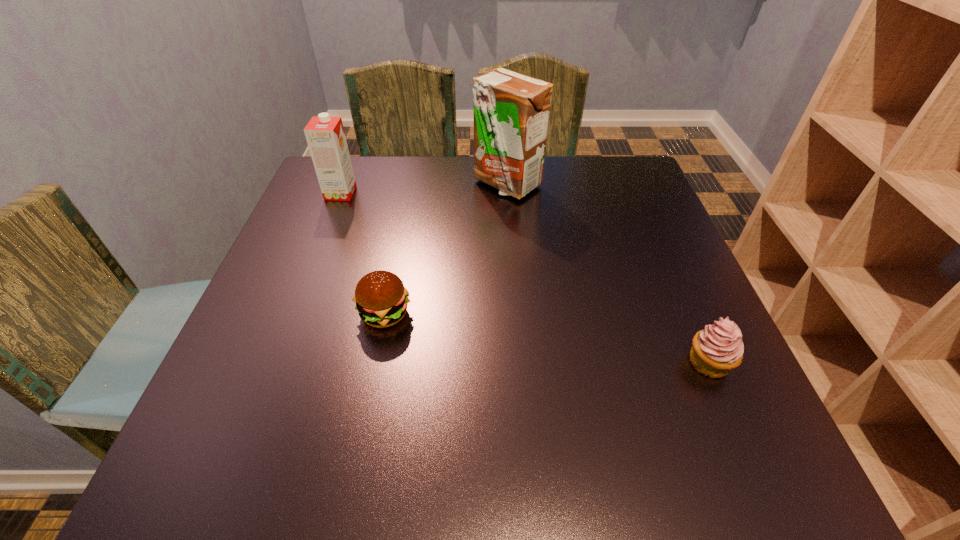
Find the location of a particular element. The height and width of the screenshot is (540, 960). vacant space at the near left corner is located at coordinates (258, 431).

What are the coordinates of `vacant space at the far right corner of the desktop` in the screenshot? It's located at (607, 180).

Locate an element on the screen. This screenshot has height=540, width=960. vacant region between the left carton and the third farthest object is located at coordinates (363, 253).

Where is `blank region between the cupcake and the second object from right to left`? The image size is (960, 540). blank region between the cupcake and the second object from right to left is located at coordinates [608, 273].

I want to click on unoccupied position between the leftmost object and the second nearest object, so click(x=363, y=253).

You are a GUI agent. You are given a task and a screenshot of the screen. Output one action in this format:
    pyautogui.click(x=<x>, y=<y>)
    Task: Click on the empty space that is in between the third object from right to left and the leftmost object
    The height and width of the screenshot is (540, 960).
    Given the screenshot: What is the action you would take?
    pyautogui.click(x=363, y=253)

The width and height of the screenshot is (960, 540). Find the location of `empty location between the third object from left to right and the cupcake`. empty location between the third object from left to right and the cupcake is located at coordinates (608, 273).

Find the location of a particular element. The height and width of the screenshot is (540, 960). vacant point located between the nearest object and the second object from left to right is located at coordinates (547, 338).

Where is `vacant point located between the leftmost object and the right carton`? The image size is (960, 540). vacant point located between the leftmost object and the right carton is located at coordinates (423, 188).

The image size is (960, 540). Identify the location of empty location between the rightmost object and the third object from left to right. (608, 273).